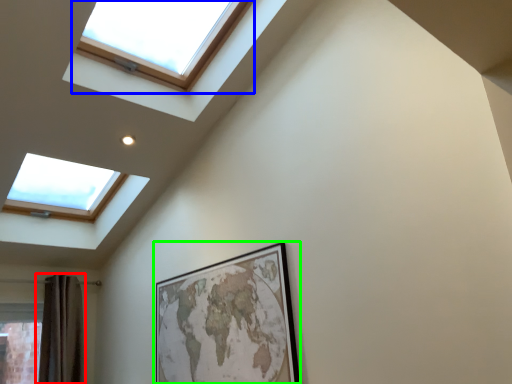
Question: Considering the real-world distances, which object is farthest from shower curtain (highlighted by a red box)? window (highlighted by a blue box) or picture frame (highlighted by a green box)?

Choices:
 (A) window
 (B) picture frame

Answer: (A)